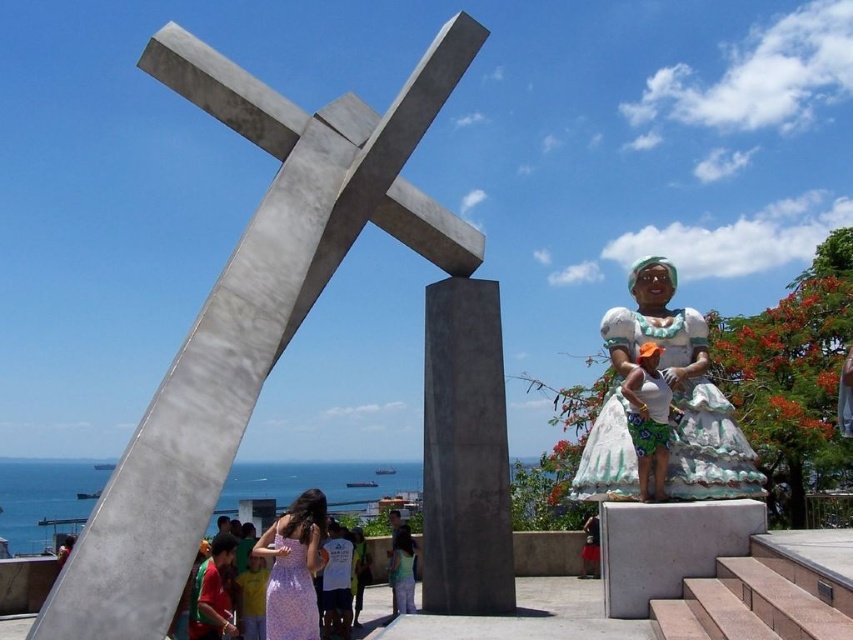
Question: From the image, what is the correct spatial relationship of white fabric statue at right in relation to purple floral dress at center?

Choices:
 (A) above
 (B) below

Answer: (A)

Question: Is purple floral dress at center below matte pink dress at center?

Choices:
 (A) yes
 (B) no

Answer: (B)

Question: Which of the following is the farthest from the observer?

Choices:
 (A) (397, 586)
 (B) (282, 568)
 (C) (633, 392)

Answer: (A)

Question: Which object is the farthest from the white fabric statue at right?

Choices:
 (A) polished concrete cross at center
 (B) green floral skirt at right
 (C) matte pink dress at center

Answer: (C)

Question: Can you confirm if white fabric statue at right is wider than green floral skirt at right?

Choices:
 (A) yes
 (B) no

Answer: (A)

Question: Which of these objects is positioned closest to the green floral skirt at right?

Choices:
 (A) white fabric statue at right
 (B) polished concrete cross at center
 (C) matte pink dress at center

Answer: (A)